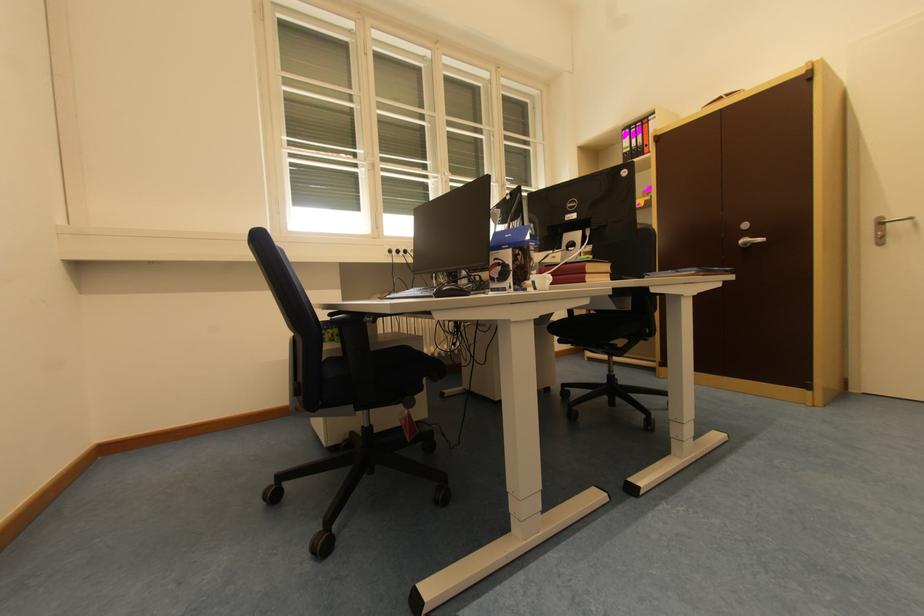
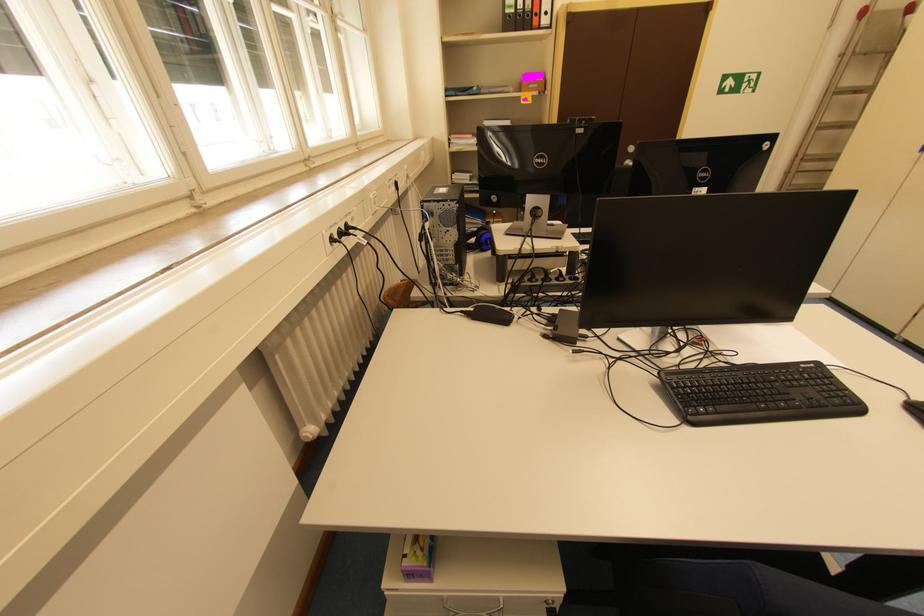
Locate, in the second image, the point that corresponds to [652,153] in the first image.

(541, 25)